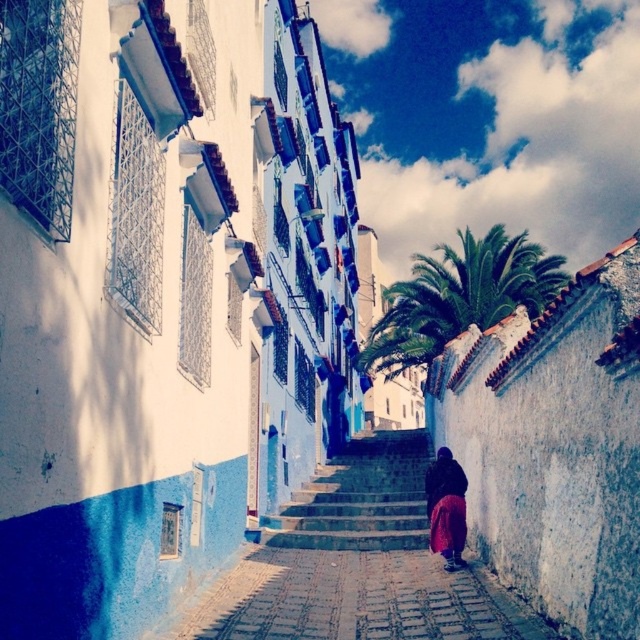
Does blue stone stairs at center have a larger size compared to dark purple fabric at center?

Yes, blue stone stairs at center is bigger than dark purple fabric at center.

This screenshot has height=640, width=640. What do you see at coordinates (360, 499) in the screenshot? I see `blue stone stairs at center` at bounding box center [360, 499].

The image size is (640, 640). What do you see at coordinates (360, 499) in the screenshot?
I see `blue stone stairs at center` at bounding box center [360, 499].

Locate an element on the screen. This screenshot has width=640, height=640. blue stone stairs at center is located at coordinates (360, 499).

Who is lower down, green leafy palm at upper center or blue stone stairs at center?

blue stone stairs at center is below.

From the picture: Is the position of green leafy palm at upper center less distant than that of blue stone stairs at center?

No, it is not.

Does point (461, 305) come in front of point (355, 540)?

No, (461, 305) is behind (355, 540).

Where is `green leafy palm at upper center`? green leafy palm at upper center is located at coordinates (460, 296).

Is smooth stone steps at center above dark purple fabric at center?

Incorrect, smooth stone steps at center is not positioned above dark purple fabric at center.

Who is more distant from viewer, (330, 493) or (449, 499)?

Point (330, 493)

At what (x,y) coordinates should I click in order to perform the action: click on smooth stone steps at center. Please return your answer as a coordinate pair (x, y). Image resolution: width=640 pixels, height=640 pixels. Looking at the image, I should click on (358, 564).